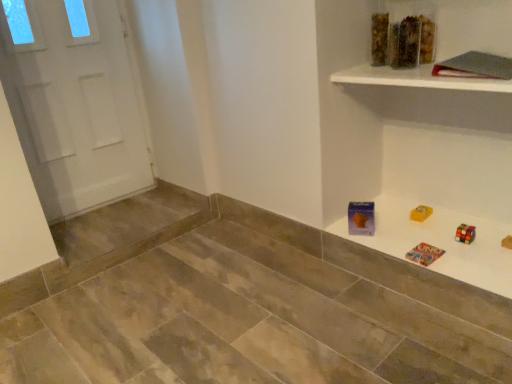
This screenshot has width=512, height=384. I want to click on vacant area that is in front of translucent plastic container at upper center, so click(388, 74).